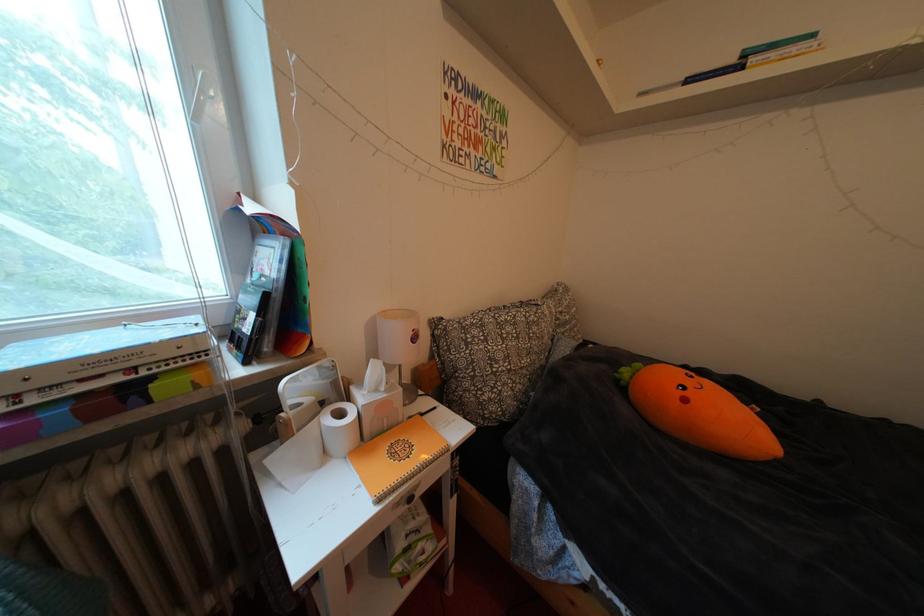
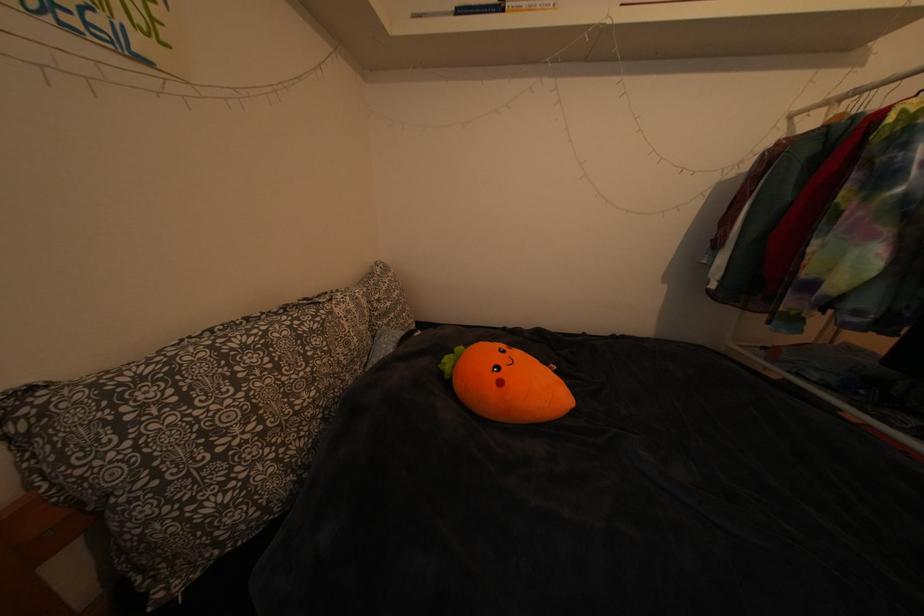
Locate, in the second image, the point that corresponds to (695,405) in the first image.

(511, 389)